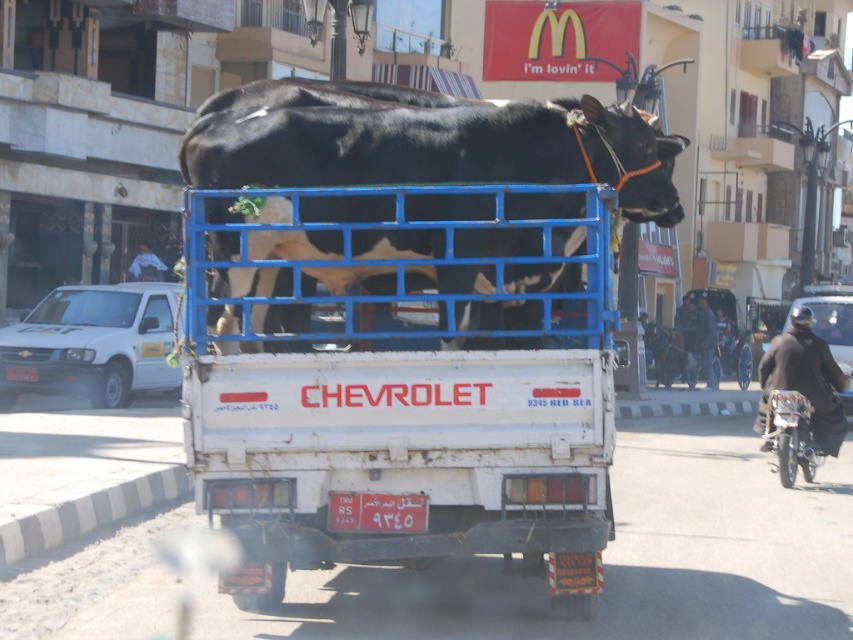
You are a pedestrian standing on the sidewalk. You see a white matte truck at center and a metallic silver motorcycle at right. Which vehicle is nearer to you?

The white matte truck at center is closer to the viewer than the metallic silver motorcycle at right, so the white matte truck at center is nearer to you.

You are a pedestrian standing on the sidewalk. You see a white matte truck at center and a white matte truck at left. Which truck is closer to your right side?

The white matte truck at center is closer to your right side because it is positioned to the right of the white matte truck at left.

You are a delivery person who needs to unload the shiny black bull at center from the truck. The metallic silver motorcycle at right is parked nearby. Can you safely lower the bull down from the truck bed without hitting the motorcycle?

The shiny black bull at center is above metallic silver motorcycle at right, so yes, you can safely lower the bull down from the truck bed without hitting the motorcycle since it is positioned higher than the motorcycle.